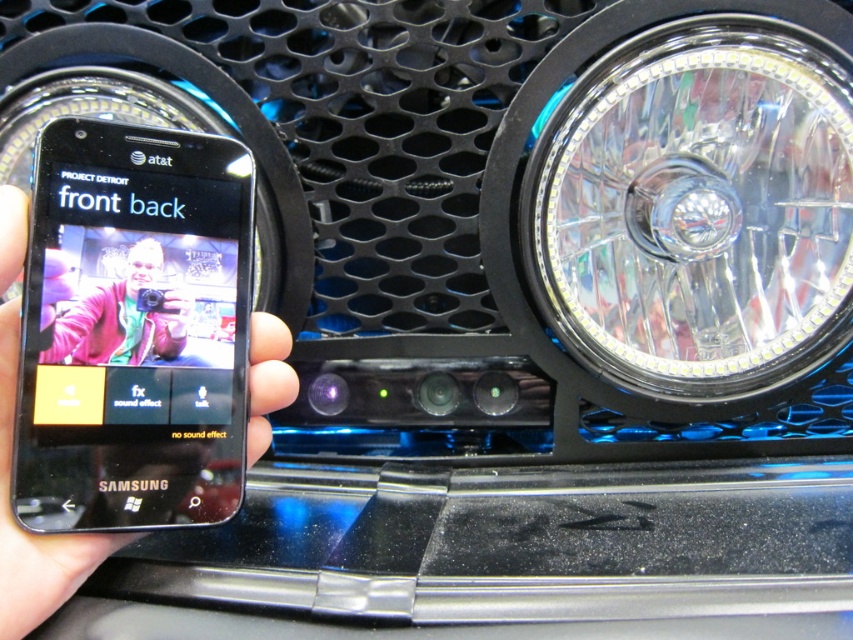
Question: In this image, where is clear glass headlight at right located relative to black matte phone at left?

Choices:
 (A) above
 (B) below

Answer: (A)

Question: Is clear glass headlight at right wider than black matte phone at left?

Choices:
 (A) yes
 (B) no

Answer: (A)

Question: Estimate the real-world distances between objects in this image. Which object is closer to the matte pink jacket at center?

Choices:
 (A) clear glass headlight at right
 (B) black matte phone at left

Answer: (B)

Question: Can you confirm if black matte phone at left is positioned to the left of matte pink jacket at center?

Choices:
 (A) no
 (B) yes

Answer: (A)

Question: Which object appears closest to the camera in this image?

Choices:
 (A) clear glass headlight at right
 (B) black matte phone at left
 (C) matte pink jacket at center

Answer: (B)

Question: Which object is farther from the camera taking this photo?

Choices:
 (A) clear glass headlight at right
 (B) black matte phone at left

Answer: (A)